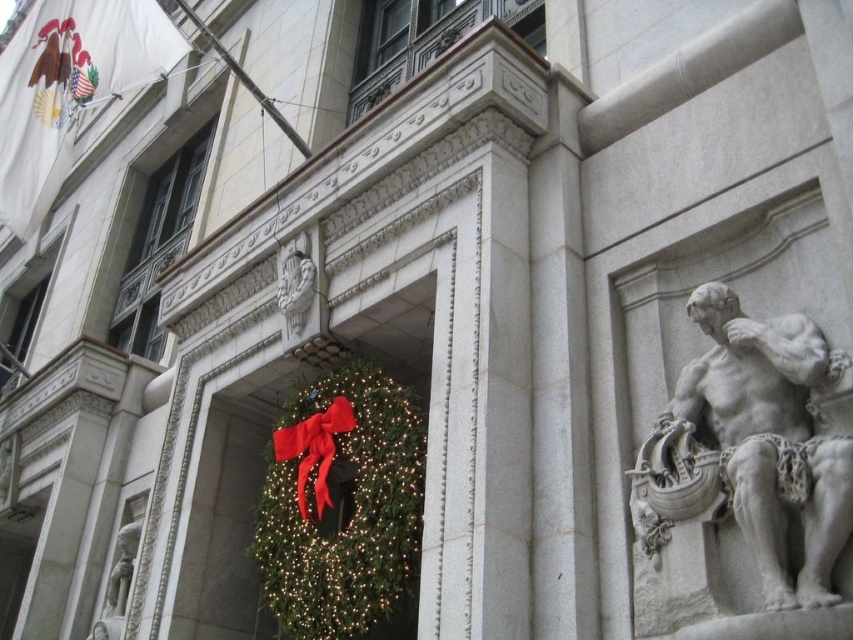
You are an architect examining the building facade. You see the white stone statue at right and the green textured wreath at center. Which object is located to the right of the other?

The white stone statue at right is positioned on the right side of green textured wreath at center, so the white stone statue at right is to the right of the green textured wreath at center.

You are an architect examining the building facade. You notice the white stone statue at right and the green textured wreath at center. Which object is positioned higher on the facade?

The white stone statue at right is located above the green textured wreath at center, so it is positioned higher on the facade.

You are standing at a point 101.44 feet away from the point marked at coordinates [827,342] in the image. Given that the building is part of a government complex, would you be able to see the intricate details of the stone relief if you were standing at your current position?

The point marked at coordinates [827,342] is 101.44 feet away from your current position. Since the distance is quite far, it might be challenging to see the intricate details of the stone relief clearly without assistance like binoculars or a closer approach.